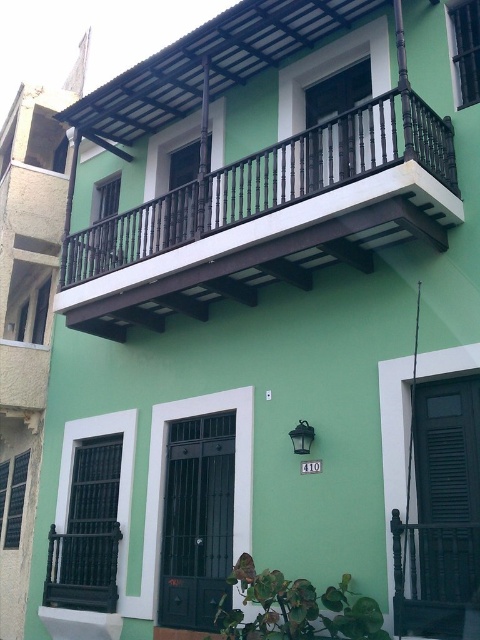
Question: Is black metal/glass at left positioned at the back of black metal/brown wood at upper center?

Choices:
 (A) yes
 (B) no

Answer: (B)

Question: Which point is closer to the camera?

Choices:
 (A) (86, 593)
 (B) (467, 28)

Answer: (B)

Question: Can you confirm if black matte shutter at right is smaller than black metal/glass at left?

Choices:
 (A) no
 (B) yes

Answer: (B)

Question: Estimate the real-world distances between objects in this image. Which object is closer to the dark brown wood balcony at upper center?

Choices:
 (A) black metal shutter at lower left
 (B) black metal/brown wood at upper center

Answer: (B)

Question: In this image, where is green matte shutter at upper right located relative to black metal shutter at lower left?

Choices:
 (A) left
 (B) right

Answer: (B)

Question: Which of the following is the farthest from the observer?

Choices:
 (A) black metal/brown wood at lower left
 (B) black metal shutter at lower left

Answer: (B)